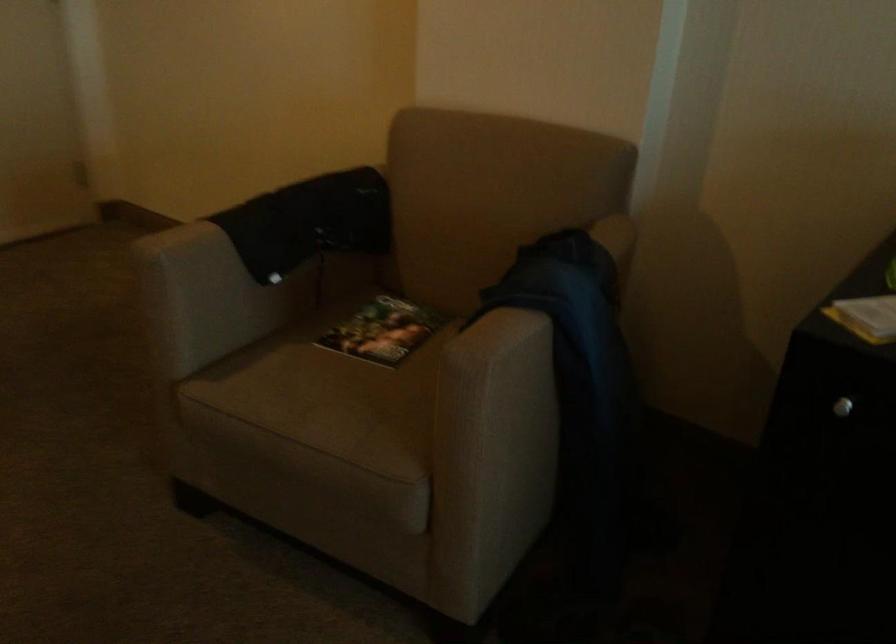
The height and width of the screenshot is (644, 896). What are the coordinates of `magazine on chair` in the screenshot? It's located at (382, 330).